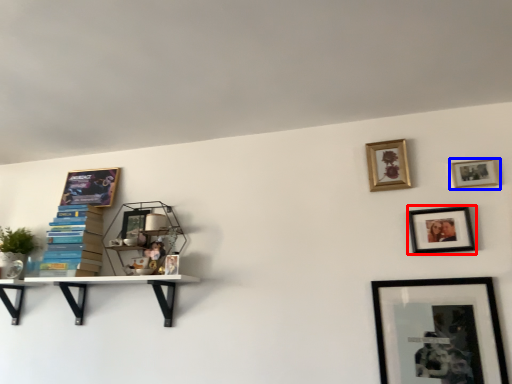
Question: Which of the following is the closest to the observer, picture frame (highlighted by a red box) or picture frame (highlighted by a blue box)?

Choices:
 (A) picture frame
 (B) picture frame

Answer: (A)